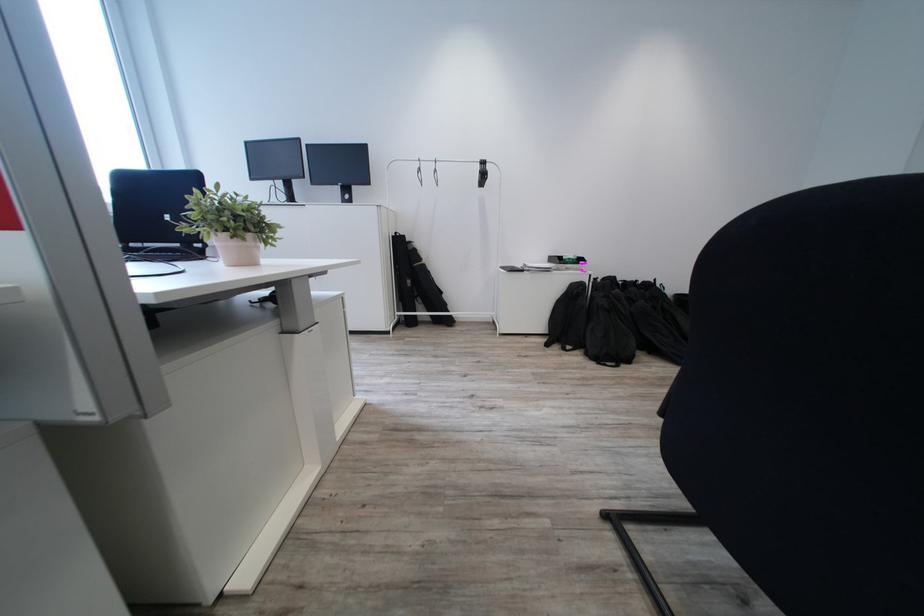
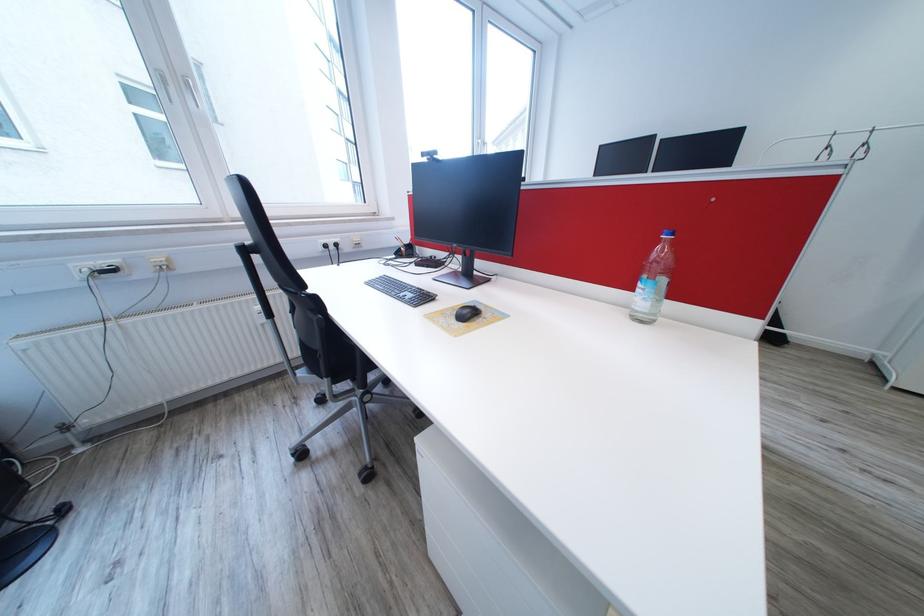
Question: The camera is either moving clockwise (left) or counter-clockwise (right) around the object. The first image is from the beginning of the video and the second image is from the end. Is the camera moving left or right when shooting the video?

Choices:
 (A) Left
 (B) Right

Answer: (B)